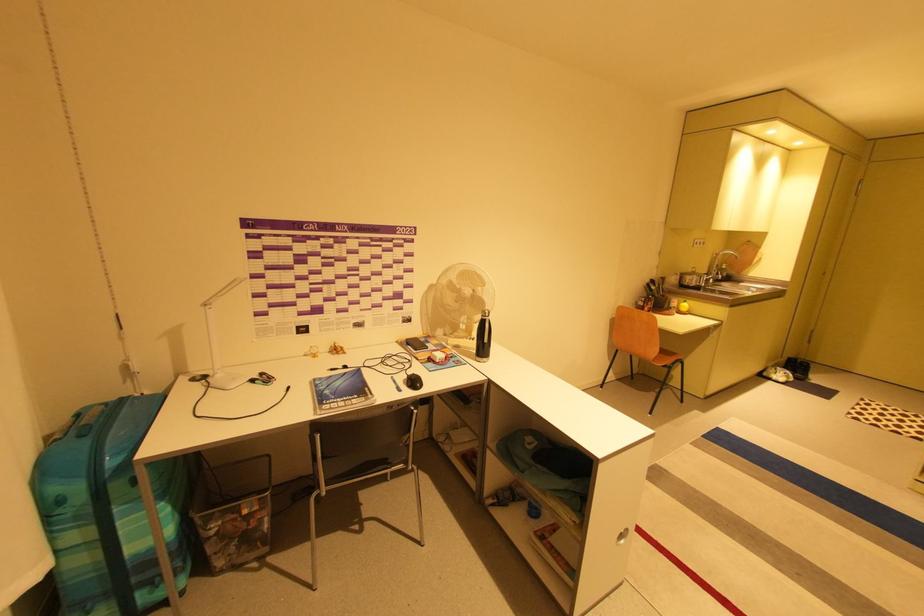
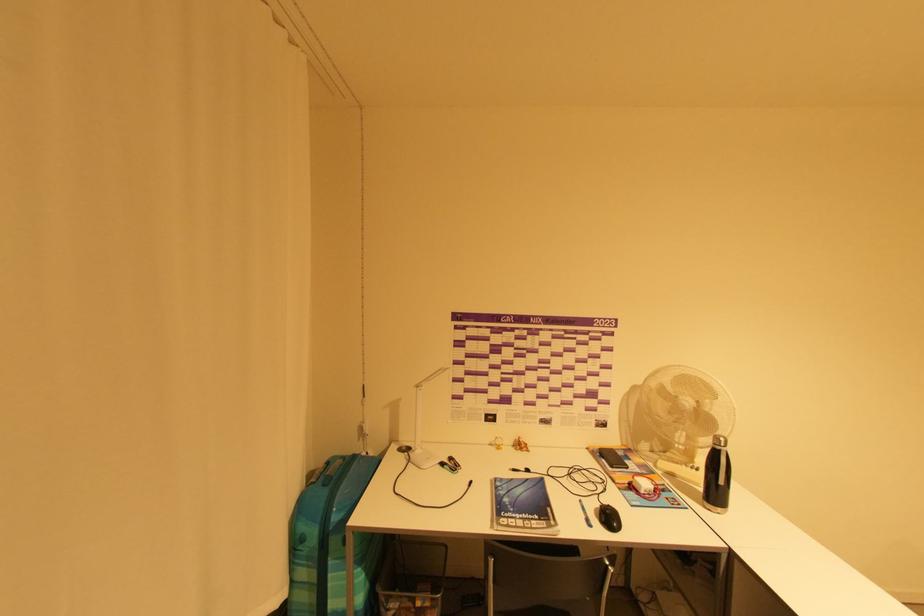
Locate, in the second image, the point that corresponds to (492,313) in the first image.

(726, 440)